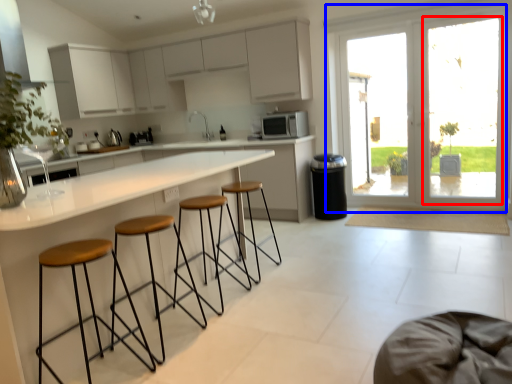
Question: Which object appears closest to the camera in this image, window screen (highlighted by a red box) or door (highlighted by a blue box)?

Choices:
 (A) window screen
 (B) door

Answer: (A)